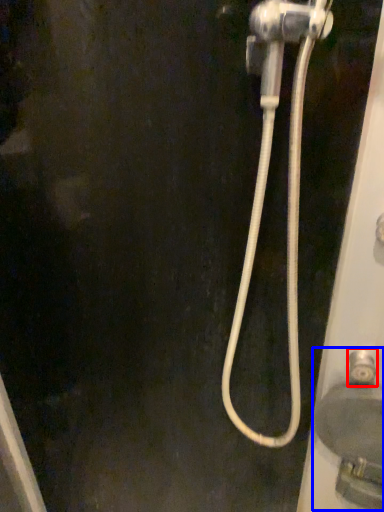
Question: Which point is closer to the camera, faucet (highlighted by a red box) or sink (highlighted by a blue box)?

Choices:
 (A) faucet
 (B) sink

Answer: (B)